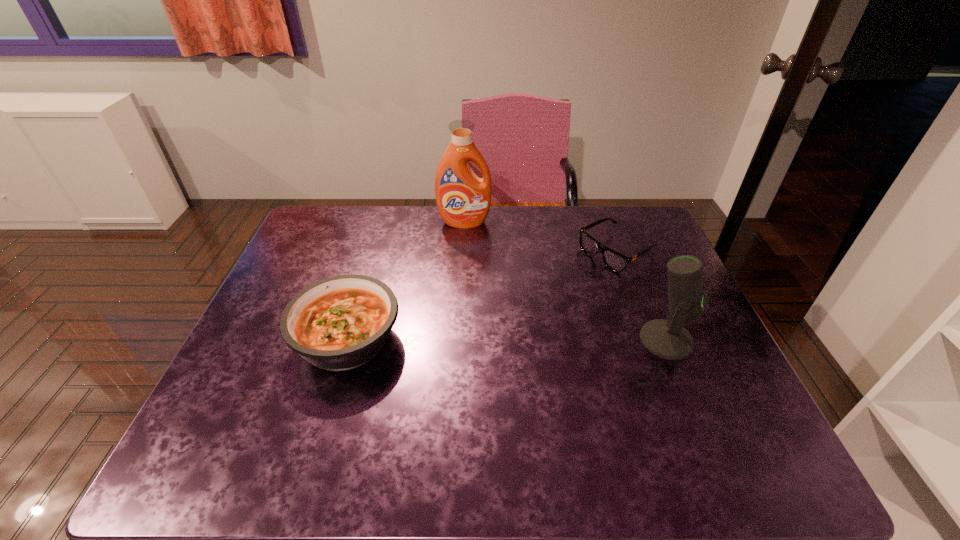
At what (x,y) coordinates should I click in order to perform the action: click on vacant area that lies between the stew and the farthest object. Please return your answer as a coordinate pair (x, y). The height and width of the screenshot is (540, 960). Looking at the image, I should click on (406, 280).

Find the location of a particular element. Image resolution: width=960 pixels, height=540 pixels. blank region between the second farthest object and the detergent is located at coordinates (540, 237).

Locate an element on the screen. free space between the second farthest object and the second tallest object is located at coordinates (641, 296).

This screenshot has width=960, height=540. I want to click on blank region between the third shortest object and the sunglasses, so click(641, 296).

This screenshot has width=960, height=540. Find the location of `free space between the sunglasses and the tallest object`. free space between the sunglasses and the tallest object is located at coordinates (540, 237).

Where is `vacant space that is in between the stew and the third nearest object`? This screenshot has height=540, width=960. vacant space that is in between the stew and the third nearest object is located at coordinates (482, 295).

Where is `free space between the farthest object and the microphone`? The width and height of the screenshot is (960, 540). free space between the farthest object and the microphone is located at coordinates (565, 281).

Image resolution: width=960 pixels, height=540 pixels. What are the coordinates of `vacant space in between the second shortest object and the sunglasses` in the screenshot? It's located at (482, 295).

This screenshot has width=960, height=540. In order to click on vacant area that lies between the second tallest object and the third object from right to left in this screenshot , I will do `click(565, 281)`.

Identify which object is located as the nearest to the farthest object. Please provide its 2D coordinates. Your answer should be formatted as a tuple, i.e. [(x, y)], where the tuple contains the x and y coordinates of a point satisfying the conditions above.

[(613, 260)]